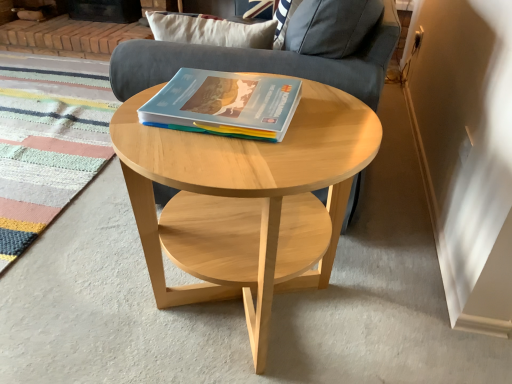
You are a GUI agent. You are given a task and a screenshot of the screen. Output one action in this format:
    pyautogui.click(x=<x>, y=<y>)
    Task: Click on the vacant area to the right of natural wood coffee table at center
    
    Given the screenshot: What is the action you would take?
    pyautogui.click(x=391, y=286)